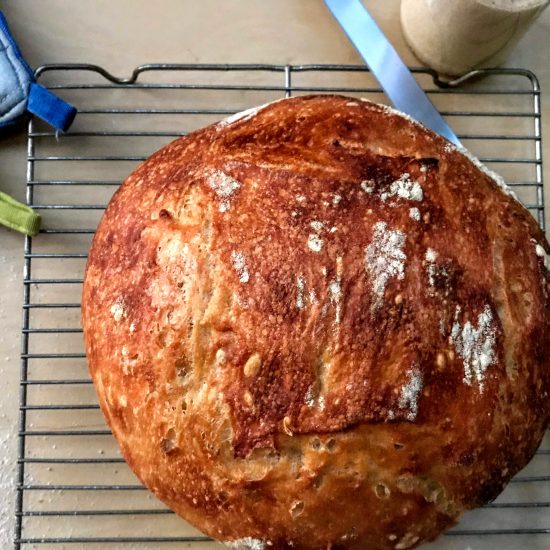
Find the location of `left side of rack`. left side of rack is located at coordinates (25, 298).